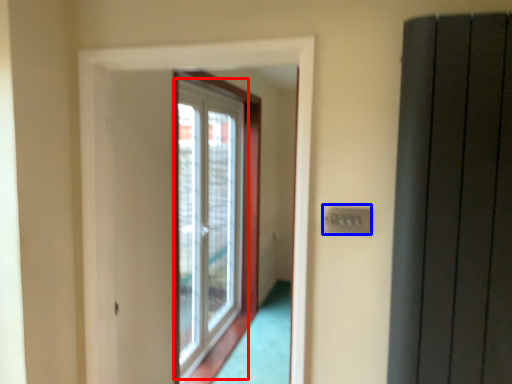
Question: Among these objects, which one is nearest to the camera, window (highlighted by a red box) or electric outlet (highlighted by a blue box)?

Choices:
 (A) window
 (B) electric outlet

Answer: (B)